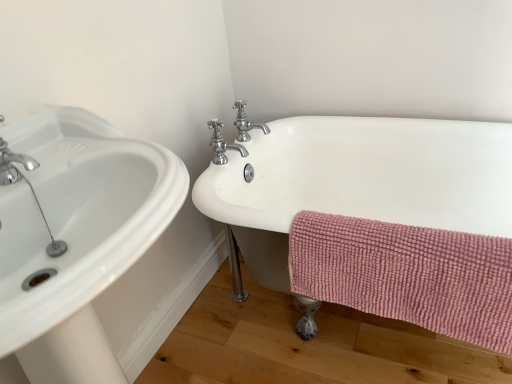
The width and height of the screenshot is (512, 384). What are the coordinates of `vacant point above pink chenille towel at lower right (from a real-world perspective)` in the screenshot? It's located at (394, 231).